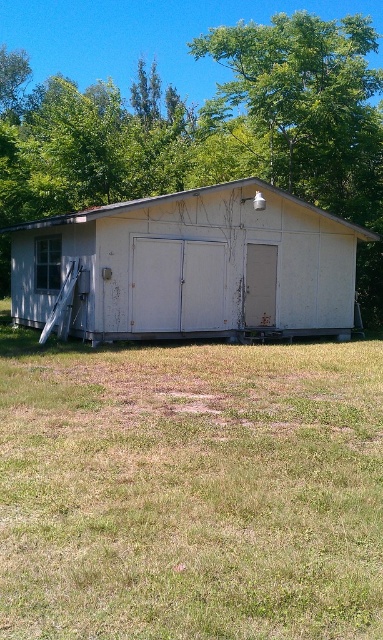
Who is lower down, brown dry grass at center or green leafy tree at upper center?

brown dry grass at center is below.

Between brown dry grass at center and green leafy tree at upper center, which one appears on the left side from the viewer's perspective?

green leafy tree at upper center is more to the left.

This screenshot has width=383, height=640. In order to click on brown dry grass at center in this screenshot , I will do `click(191, 492)`.

Can you confirm if brown dry grass at center is shorter than white matte shed at center?

Yes.

Does brown dry grass at center appear on the right side of white matte shed at center?

In fact, brown dry grass at center is to the left of white matte shed at center.

Based on the photo, who is more distant from viewer, (253,390) or (301,218)?

Positioned behind is point (301,218).

You are a GUI agent. You are given a task and a screenshot of the screen. Output one action in this format:
    pyautogui.click(x=<x>, y=<y>)
    Task: Click on the brown dry grass at center
    The width and height of the screenshot is (383, 640).
    Given the screenshot: What is the action you would take?
    pyautogui.click(x=191, y=492)

Who is taller, green leafy tree at upper center or white matte shed at center?

Standing taller between the two is green leafy tree at upper center.

Is green leafy tree at upper center smaller than white matte shed at center?

No.

The width and height of the screenshot is (383, 640). What do you see at coordinates (209, 129) in the screenshot?
I see `green leafy tree at upper center` at bounding box center [209, 129].

You are a GUI agent. You are given a task and a screenshot of the screen. Output one action in this format:
    pyautogui.click(x=<x>, y=<y>)
    Task: Click on the green leafy tree at upper center
    This screenshot has width=383, height=640.
    Given the screenshot: What is the action you would take?
    pyautogui.click(x=209, y=129)